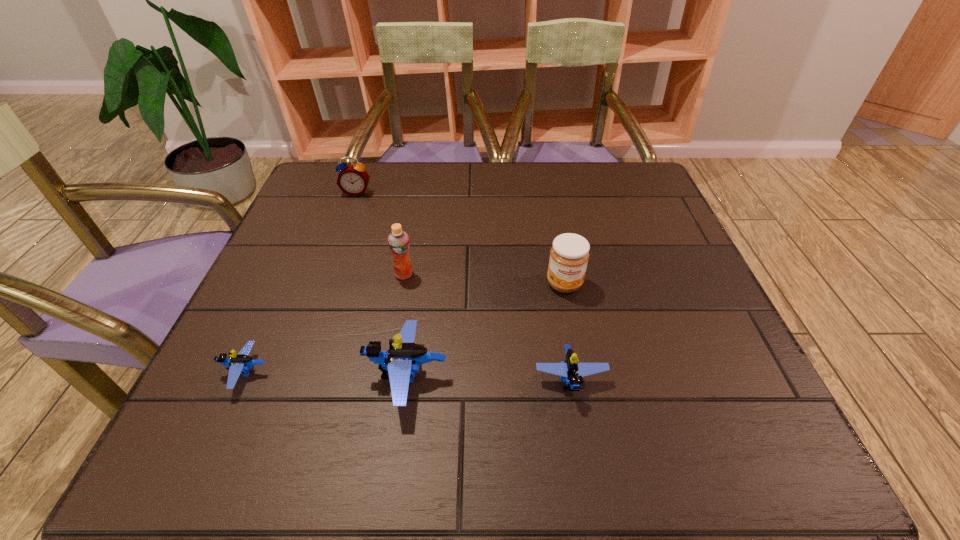
Please show where to add a Lego on the right while keeping spacing even. Please provide its 2D coordinates. Your answer should be formatted as a tuple, i.e. [(x, y)], where the tuple contains the x and y coordinates of a point satisfying the conditions above.

[(735, 383)]